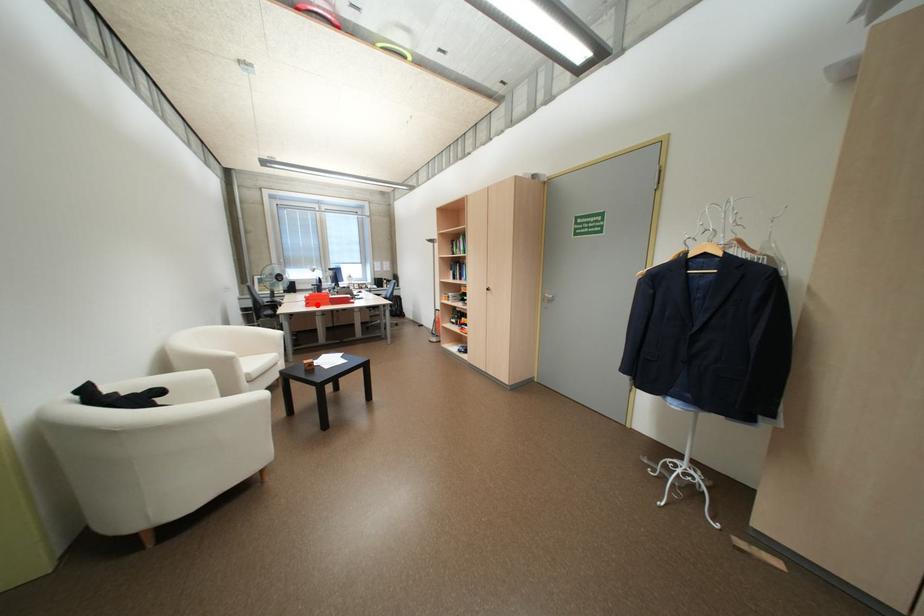
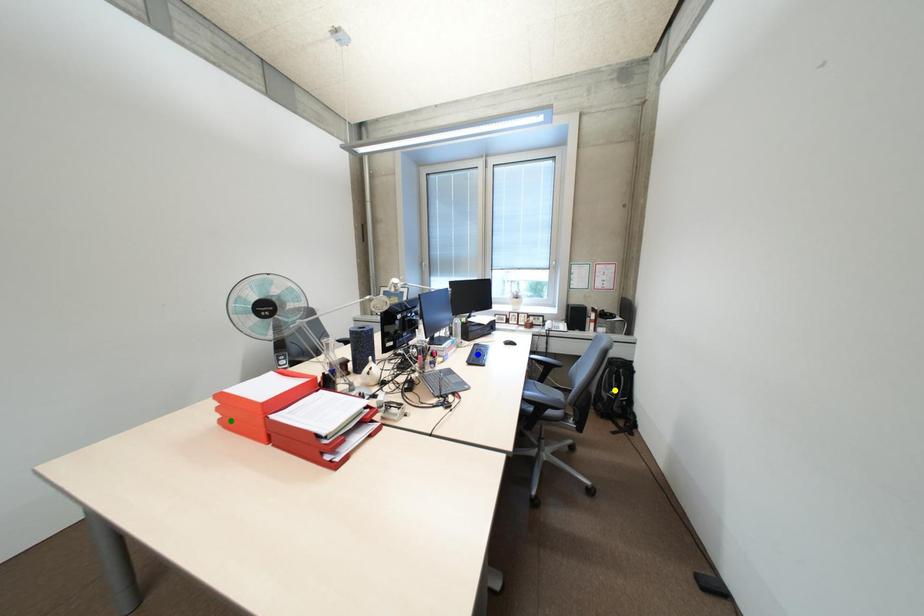
Question: I am providing you with two images of the same scene from different viewpoints. A red point is marked on the first image. You are given multiple points on the second image. Which mark in image 2 goes with the point in image 1?

Choices:
 (A) blue point
 (B) yellow point
 (C) green point

Answer: (C)